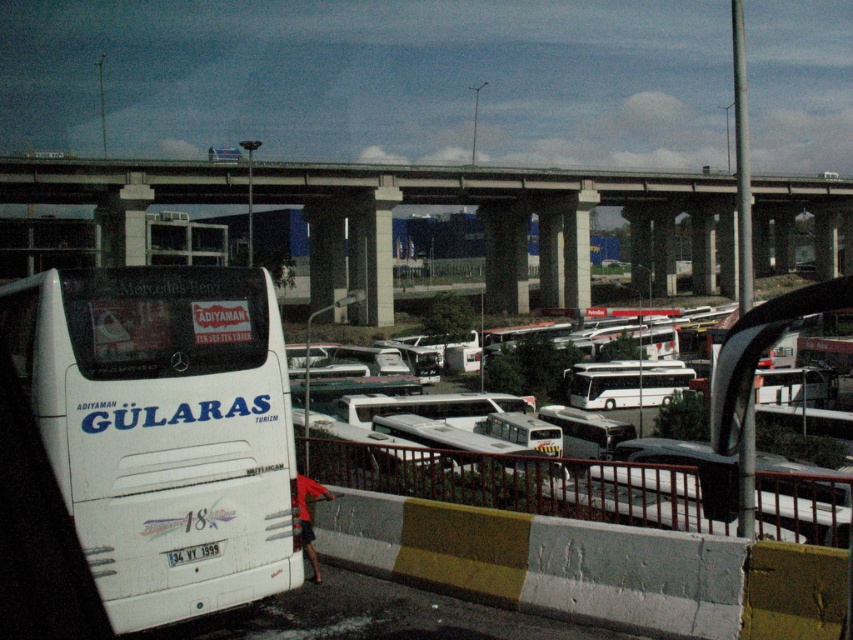
Question: Which point is closer to the camera?

Choices:
 (A) concrete at center
 (B) white matte bus at left

Answer: (B)

Question: Is white matte bus at left to the right of concrete at center from the viewer's perspective?

Choices:
 (A) yes
 (B) no

Answer: (B)

Question: Which point is closer to the camera?

Choices:
 (A) white matte bus at left
 (B) concrete at center

Answer: (A)

Question: From the image, what is the correct spatial relationship of white matte bus at left in relation to white plastic license plate at lower center?

Choices:
 (A) right
 (B) left

Answer: (B)

Question: Which of these objects is positioned farthest from the concrete at center?

Choices:
 (A) white matte bus at left
 (B) white plastic license plate at lower center

Answer: (B)

Question: Does concrete at center have a smaller size compared to white plastic license plate at lower center?

Choices:
 (A) yes
 (B) no

Answer: (B)